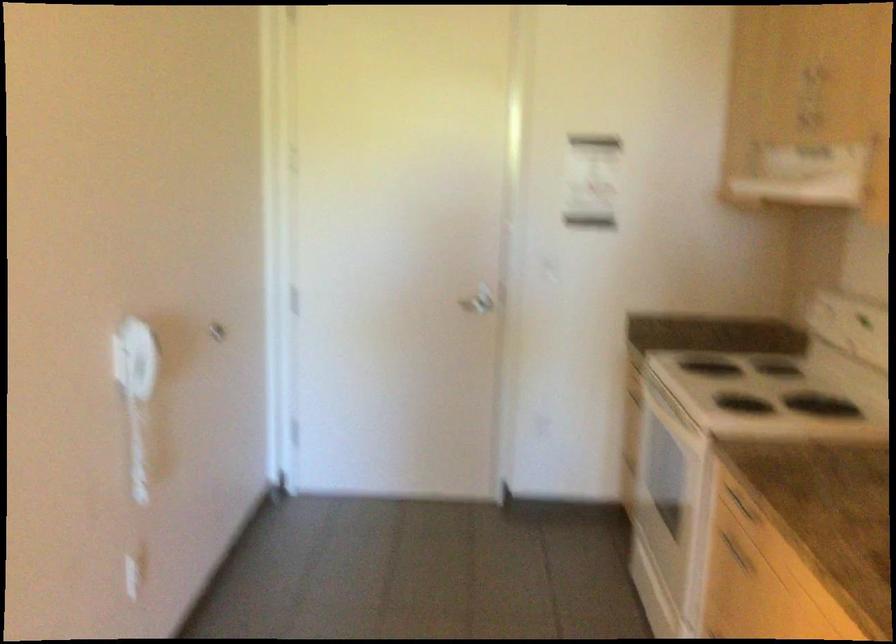
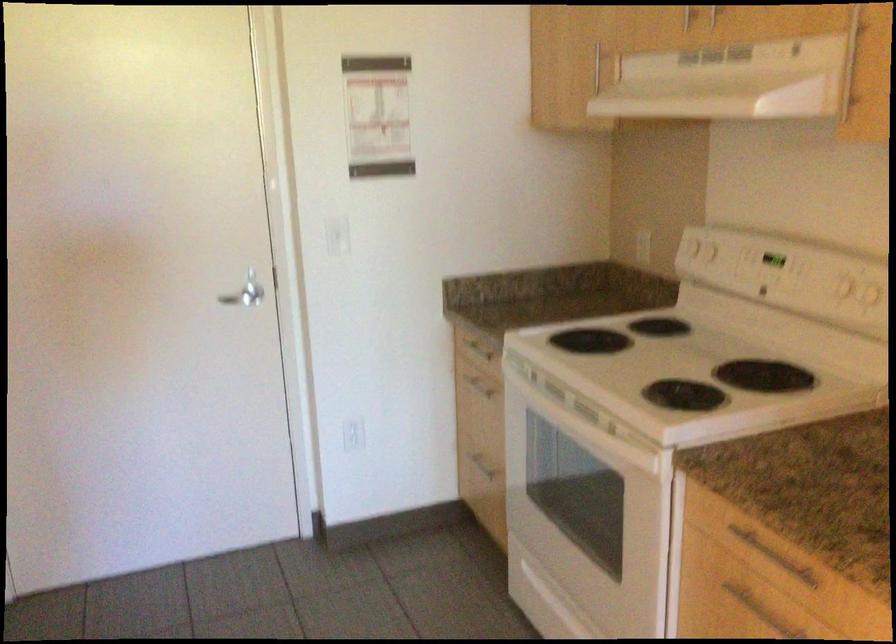
The point at (819, 128) is marked in the first image. Where is the corresponding point in the second image?

(714, 15)